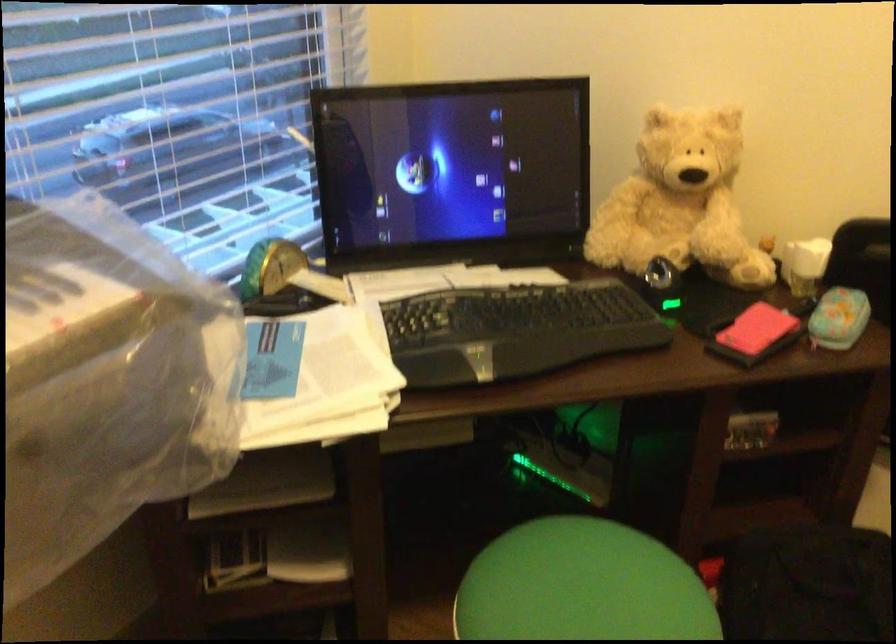
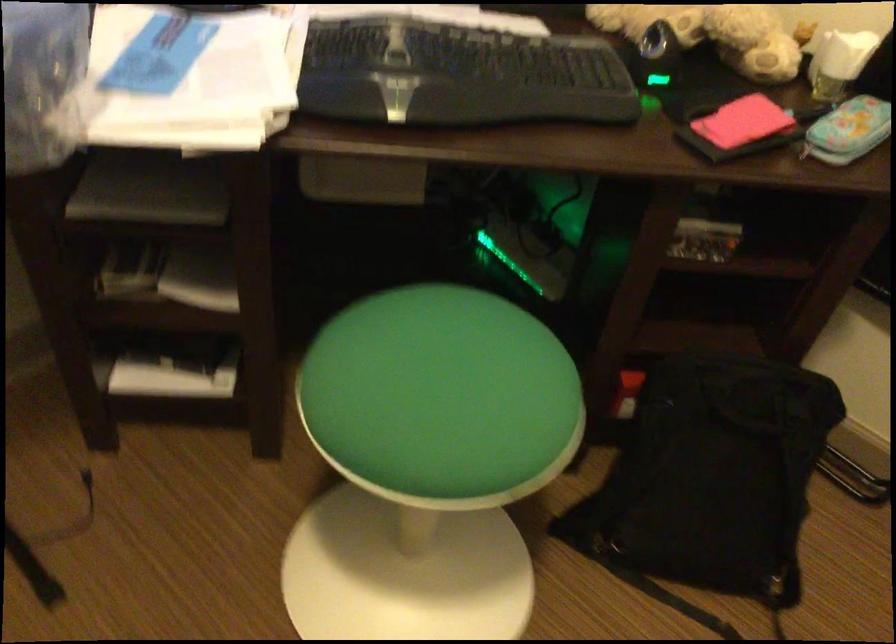
In the second image, find the point that corresponds to the point at 762,337 in the first image.

(739, 128)